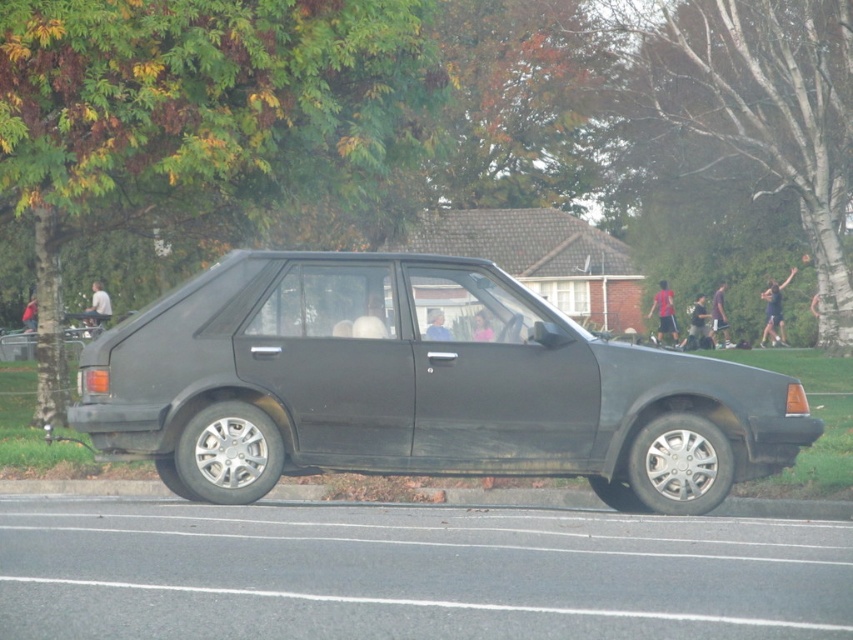
Which is above, matte black sedan at center or concrete at lower center?

matte black sedan at center is higher up.

Is matte black sedan at center to the left of concrete at lower center from the viewer's perspective?

Correct, you'll find matte black sedan at center to the left of concrete at lower center.

Which is behind, point (773, 372) or point (556, 497)?

The point (556, 497) is more distant.

Identify the location of matte black sedan at center. (418, 387).